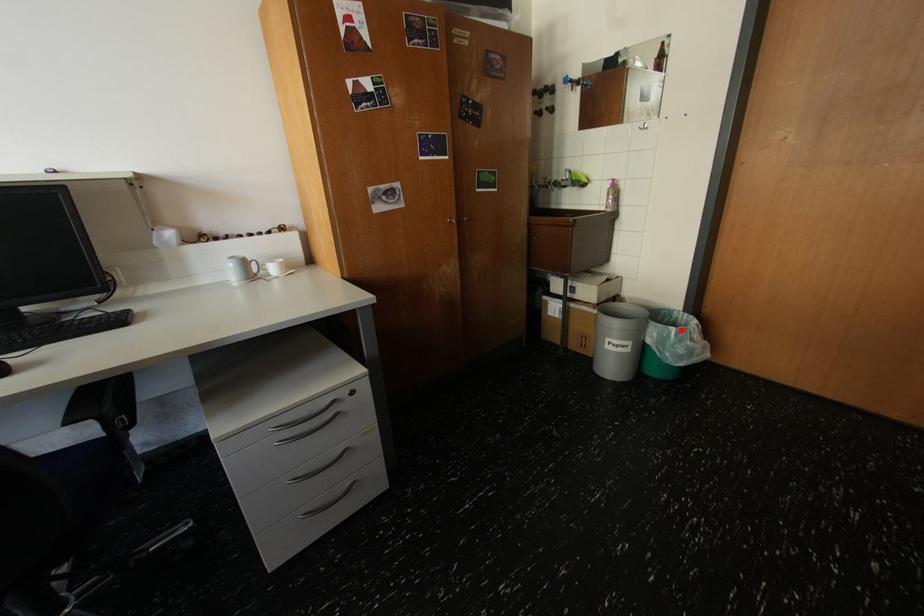
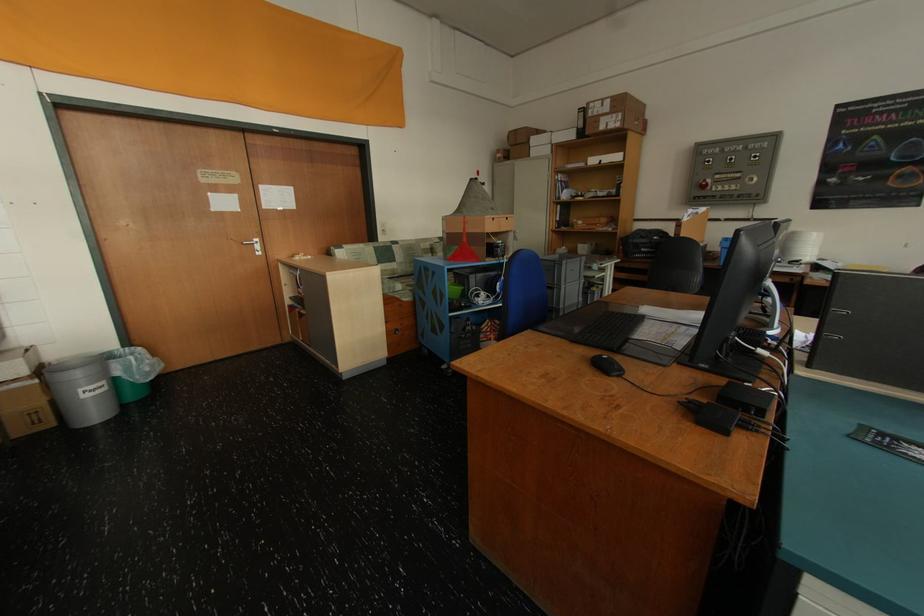
Find the pixel in the second image that matches the highlighted location in the first image.

(140, 359)